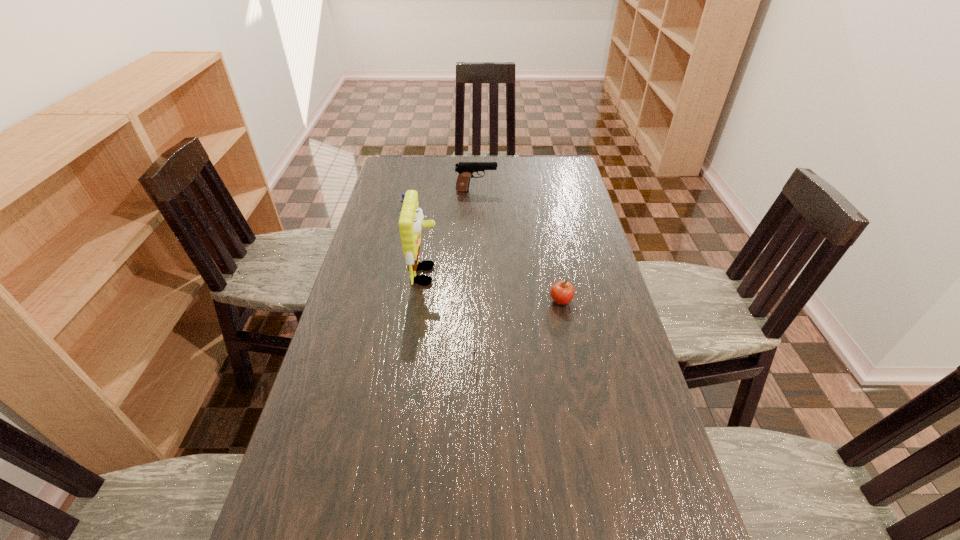
At what (x,y) coordinates should I click in order to perform the action: click on vacant space that satisfies the following two spatial constraints: 1. on the face of the second shortest object; 2. on the left side of the tallest object. Please return your answer as a coordinate pair (x, y). The height and width of the screenshot is (540, 960). Looking at the image, I should click on (421, 301).

Where is `free spot that satisfies the following two spatial constraints: 1. at the barrel of the apple; 2. on the right side of the farthest object`? The image size is (960, 540). free spot that satisfies the following two spatial constraints: 1. at the barrel of the apple; 2. on the right side of the farthest object is located at coordinates (475, 301).

I want to click on blank space that satisfies the following two spatial constraints: 1. at the barrel of the pistol; 2. on the face of the duckling, where the monocle is placed, so click(476, 221).